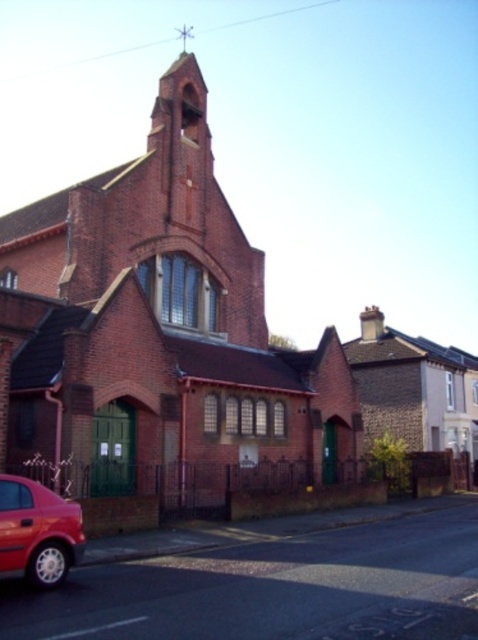
Who is lower down, red brick chapel at center or shiny red car at lower left?

shiny red car at lower left is lower down.

Which is above, red brick chapel at center or shiny red car at lower left?

Positioned higher is red brick chapel at center.

Does point (85, 364) come farther from viewer compared to point (57, 513)?

Yes, it is.

What are the coordinates of `red brick chapel at center` in the screenshot? It's located at (160, 337).